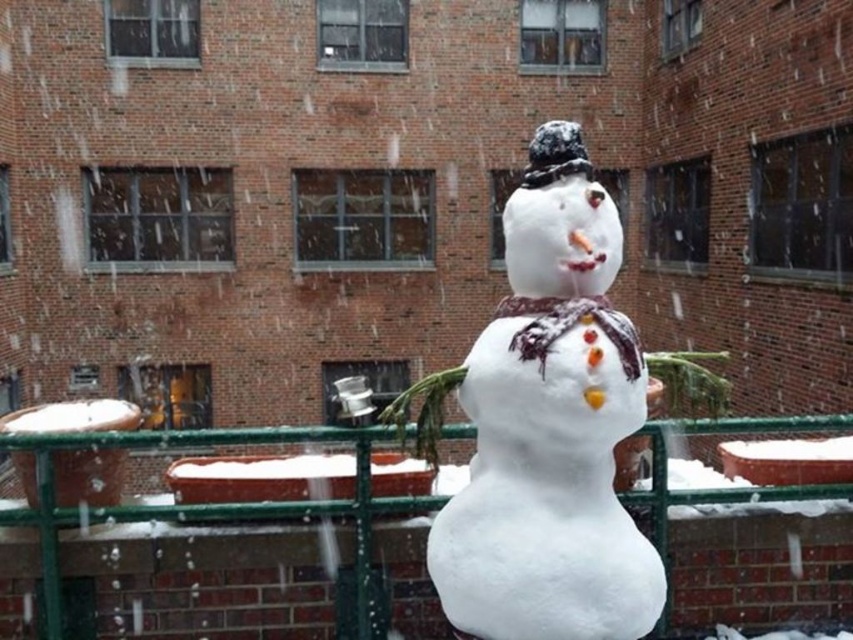
Question: Can you confirm if white fluffy snowman at center is wider than green metal fence at center?

Choices:
 (A) no
 (B) yes

Answer: (A)

Question: Can you confirm if white fluffy snowman at center is thinner than green metal fence at center?

Choices:
 (A) yes
 (B) no

Answer: (A)

Question: Is the position of white fluffy snowman at center less distant than that of green metal fence at center?

Choices:
 (A) yes
 (B) no

Answer: (A)